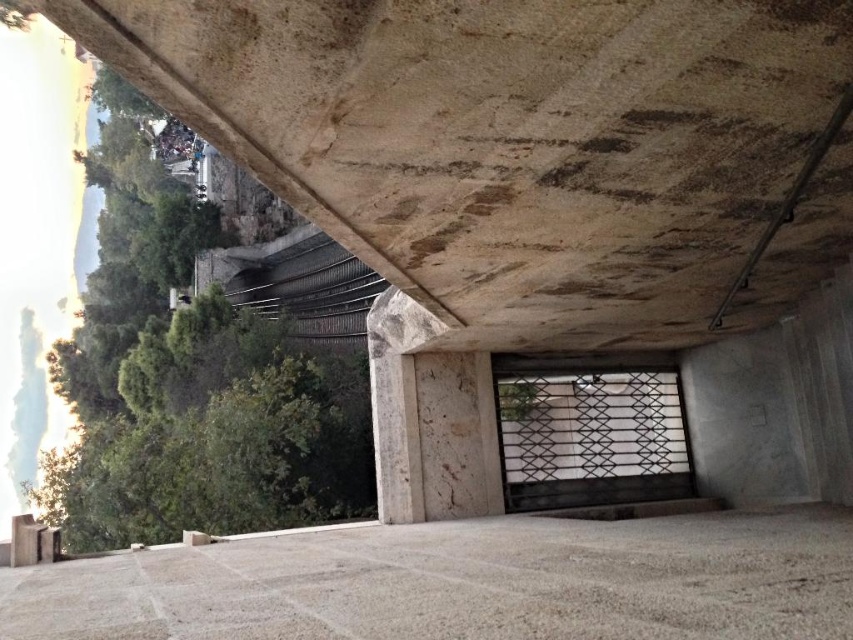
You are standing at the metal gate with a diamond shaped pattern. Looking up, you see a point marked at coordinates (527, 147). What does this point represent?

The point at coordinates (527, 147) represents the rustic stone overpass at upper center.

You are a delivery person with a cart that is 7 feet long. You need to move your cart through the space between the rustic stone overpass at upper center and the gray stone floor at center. Can your cart fit through the space vertically?

The distance between the rustic stone overpass at upper center and the gray stone floor at center is 6.79 feet. Since the cart is 7 feet long, it cannot fit vertically through the space as the available height is less than the cart length.